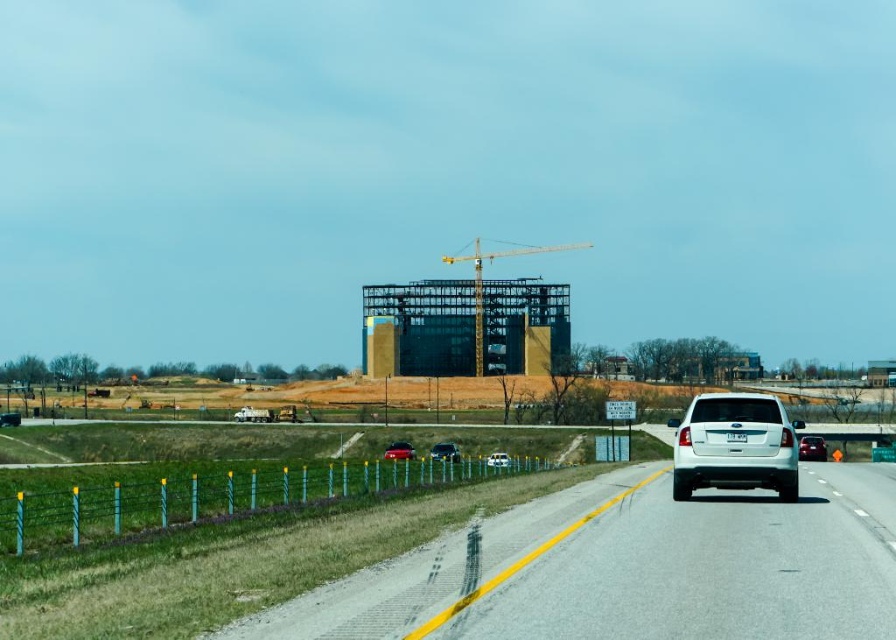
Does asphalt road at center come behind shiny silver sedan at center?

No, it is in front of shiny silver sedan at center.

Between asphalt road at center and shiny silver sedan at center, which one is positioned higher?

asphalt road at center

Is point (339, 588) closer to camera compared to point (798, 442)?

Yes, point (339, 588) is in front of point (798, 442).

Identify the location of asphalt road at center. The width and height of the screenshot is (896, 640). (630, 568).

Who is more distant from viewer, [773,522] or [472,280]?

Positioned behind is point [472,280].

Looking at this image, does asphalt road at center appear over yellow metal crane at center?

No.

Is point (674, 552) positioned after point (481, 340)?

That is False.

The width and height of the screenshot is (896, 640). I want to click on asphalt road at center, so click(630, 568).

Based on the photo, which is above, shiny black sedan at center or white matte car at center?

white matte car at center is above.

Does shiny black sedan at center have a lesser height compared to white matte car at center?

Yes.

Describe the element at coordinates (444, 451) in the screenshot. This screenshot has height=640, width=896. I see `shiny black sedan at center` at that location.

You are a GUI agent. You are given a task and a screenshot of the screen. Output one action in this format:
    pyautogui.click(x=<x>, y=<y>)
    Task: Click on the shiny black sedan at center
    The width and height of the screenshot is (896, 640).
    Given the screenshot: What is the action you would take?
    pyautogui.click(x=444, y=451)